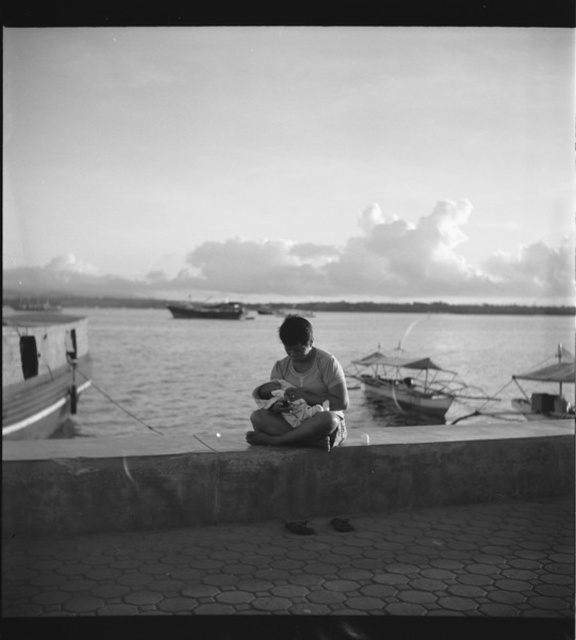
You are a photographer standing at the waterfront scene. You want to take a photo of the wooden boat at left and the soft skin baby at center. Which object should you focus on first if you want to capture both in the same frame without moving the camera?

The wooden boat at left is located above the soft skin baby at center, so you should focus on the wooden boat at left first to ensure both are in the frame.